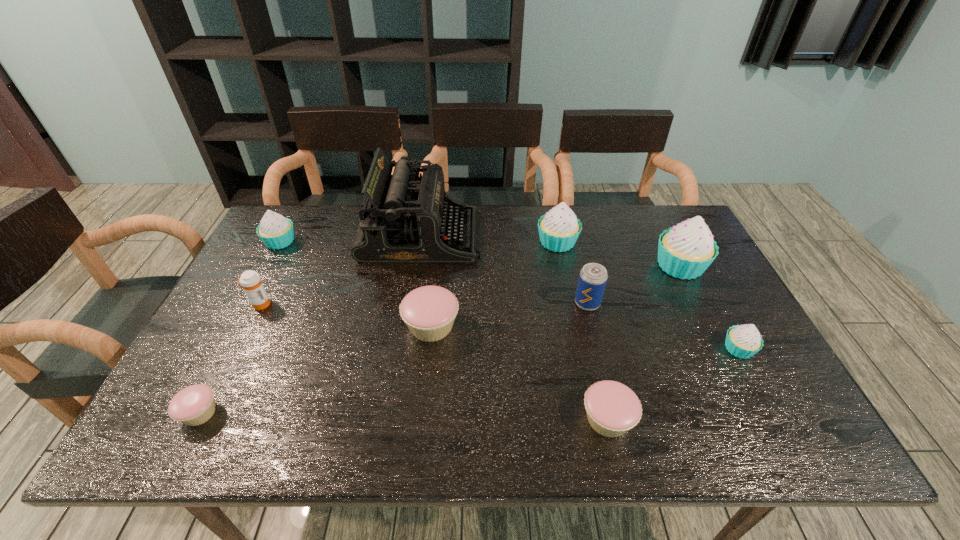
This screenshot has height=540, width=960. Identify the location of free space located 0.140m on the front of the third tallest cupcake. (258, 284).

Locate an element on the screen. free space located on the right of the medicine is located at coordinates (372, 304).

Identify the location of vacant space located 0.280m on the back of the farthest pink cupcake. (440, 242).

At what (x,y) coordinates should I click in order to perform the action: click on free space located on the back of the smallest white cupcake. Please return your answer as a coordinate pair (x, y). Looking at the image, I should click on (701, 278).

The width and height of the screenshot is (960, 540). Find the location of `vacant area situated on the back of the ninth tallest object`. vacant area situated on the back of the ninth tallest object is located at coordinates (588, 337).

Locate an element on the screen. free region located 0.390m on the back of the smallest pink cupcake is located at coordinates (269, 279).

This screenshot has width=960, height=540. I want to click on typewriter that is at the far edge, so click(404, 219).

Identify the location of medicine that is at the left edge. The height and width of the screenshot is (540, 960). (251, 282).

Where is `object situated at the far left corner`? The width and height of the screenshot is (960, 540). object situated at the far left corner is located at coordinates (276, 232).

Find the location of a particular element. The height and width of the screenshot is (540, 960). object positioned at the near left corner is located at coordinates (194, 405).